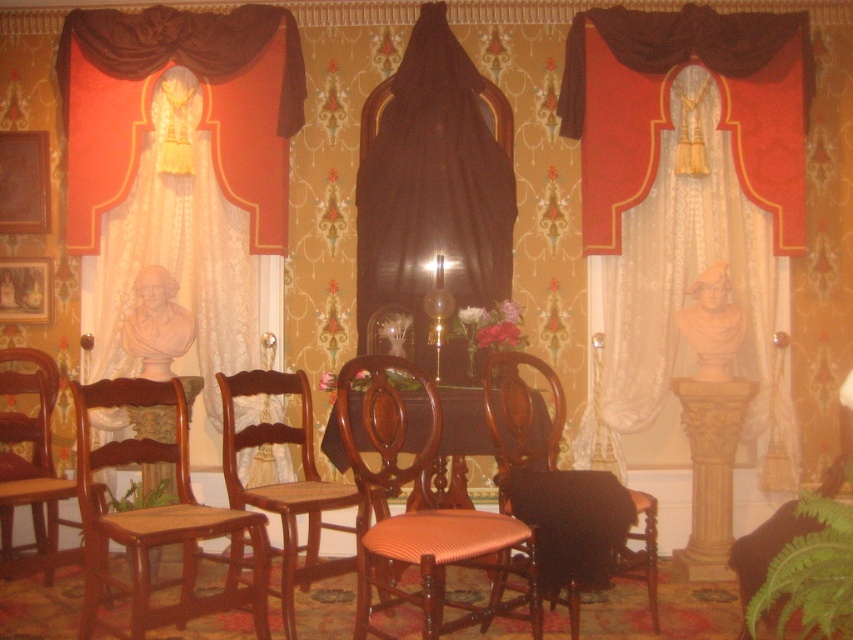
You are planning to place a large decorative item that requires a wide space. You are standing in the room and see the velvet drapery at center and the brown wood table at center. Which object would you choose to place the item next to, considering their widths?

The velvet drapery at center has a greater width than the brown wood table at center, so you should place the large decorative item next to the velvet drapery at center.

Consider the image. You are sitting in the wooden armchair at center and want to move to the wooden chair with woven seat at center. Which direction should you move to reach it?

The wooden armchair at center is positioned on the right side of the wooden chair with woven seat at center. To reach the wooden chair with woven seat at center, you should move to the left.

You are arranging a small table that is 1 meter wide between the velvet drapery at center and the wooden armchair at left. Can the table fit between them?

The velvet drapery at center is smaller than the wooden armchair at left, so the table may not fit between them as the distance might be insufficient.